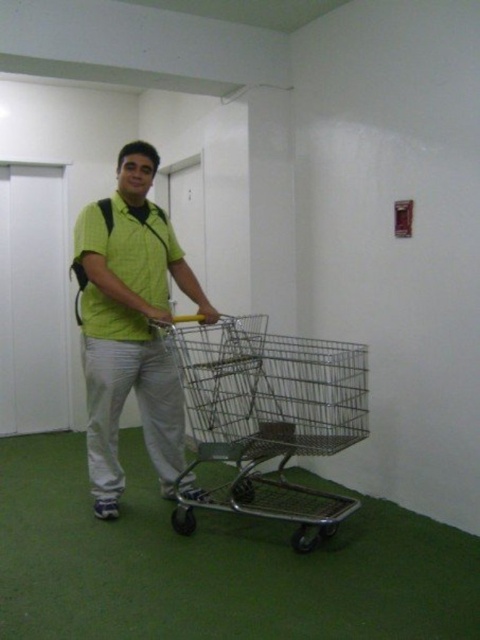
You are trying to decide which clothing item to take for a photoshoot. You have the green matte shirt at center and the green matte polo shirt at center in the image. Which one is wider?

The green matte shirt at center is wider than the green matte polo shirt at center according to the description.

You are a delivery person who needs to move the metallic wire trolley at center closer to the green matte shirt at center. How much space do you need to move it?

The metallic wire trolley at center is currently 20.09 inches away from the green matte shirt at center. To move it closer, you need to cover that distance of 20.09 inches.

You are standing in the indoor space shown in the scene. The metallic wire trolley at center is positioned at coordinates 0.653, 0.558. If you want to move to the trolley, which direction should you move relative to your current position?

The metallic wire trolley at center is located at coordinates [267,417], so you should move towards the center of the scene to reach it.